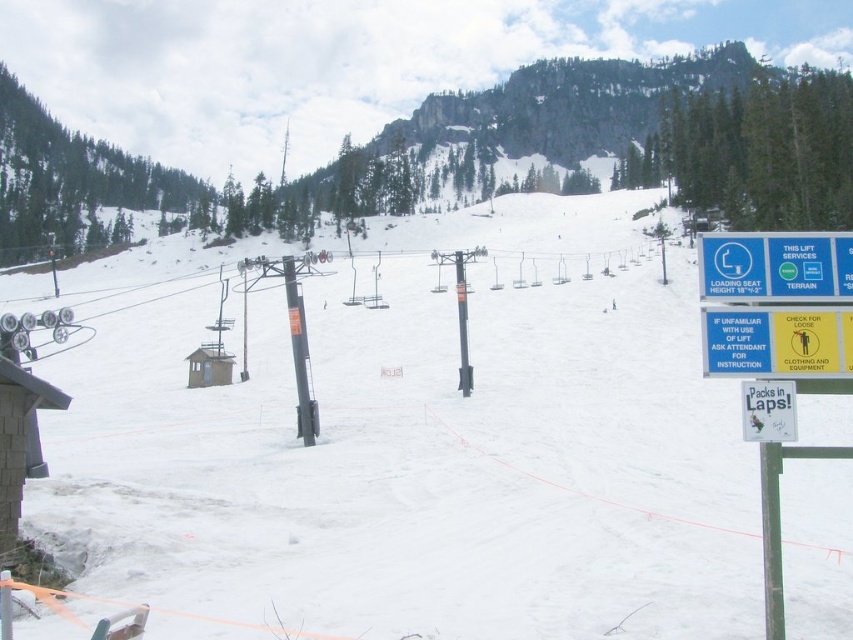
Measure the distance between white snow ski slope at center and blue plastic sign at upper right.

white snow ski slope at center and blue plastic sign at upper right are 226.49 feet apart.

Consider the image. Who is positioned more to the left, white snow ski slope at center or blue plastic sign at upper right?

Positioned to the left is white snow ski slope at center.

Measure the distance between white snow ski slope at center and camera.

white snow ski slope at center is 77.53 feet from camera.

At what (x,y) coordinates should I click in order to perform the action: click on white snow ski slope at center. Please return your answer as a coordinate pair (x, y). This screenshot has height=640, width=853. Looking at the image, I should click on click(x=415, y=444).

Is point (721, 317) farther from camera compared to point (741, 419)?

No, it is not.

Can you confirm if yellow paper sign at right is bigger than white paper sign at lower right?

Correct, yellow paper sign at right is larger in size than white paper sign at lower right.

Which is behind, point (820, 365) or point (775, 433)?

The point (820, 365) is more distant.

Identify the location of yellow paper sign at right. The height and width of the screenshot is (640, 853). (776, 340).

Who is shorter, yellow paper sign at right or blue plastic sign at upper right?

With less height is blue plastic sign at upper right.

Between yellow paper sign at right and blue plastic sign at upper right, which one is positioned higher?

blue plastic sign at upper right is higher up.

Describe the element at coordinates (776, 340) in the screenshot. The image size is (853, 640). I see `yellow paper sign at right` at that location.

Find the location of `yellow paper sign at right`. yellow paper sign at right is located at coordinates (776, 340).